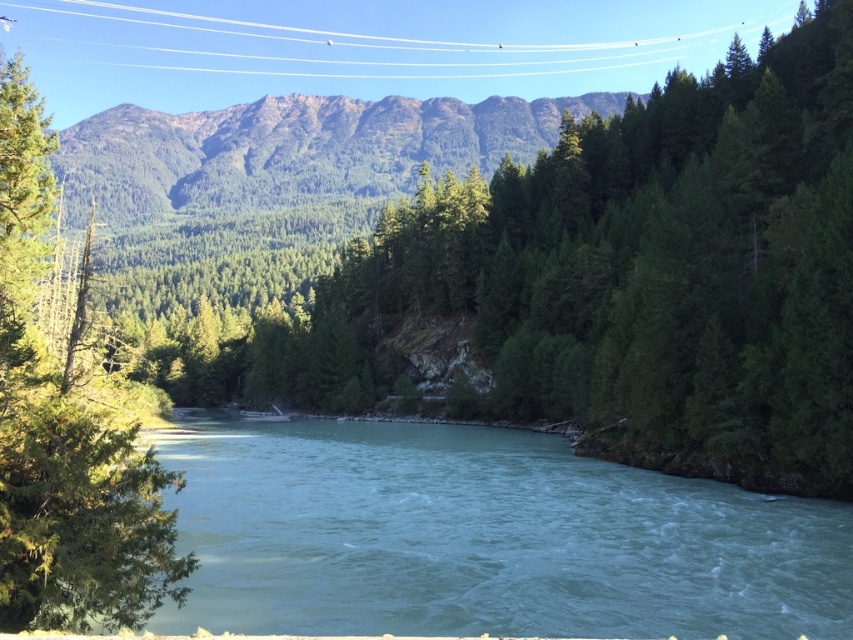
Question: Among these points, which one is farthest from the camera?

Choices:
 (A) (3, 173)
 (B) (178, 116)

Answer: (B)

Question: Does turquoise water at center lie behind green matte tree at left?

Choices:
 (A) yes
 (B) no

Answer: (A)

Question: Can you confirm if turquoise water at center is positioned above green matte tree at left?

Choices:
 (A) yes
 (B) no

Answer: (B)

Question: Which object appears farthest from the camera in this image?

Choices:
 (A) green matte tree at left
 (B) green textured mountain at upper center

Answer: (B)

Question: Observing the image, what is the correct spatial positioning of turquoise water at center in reference to green textured mountain at upper center?

Choices:
 (A) above
 (B) below

Answer: (B)

Question: Which object is farther from the camera taking this photo?

Choices:
 (A) turquoise water at center
 (B) green textured mountain at upper center
 (C) green matte tree at left

Answer: (B)